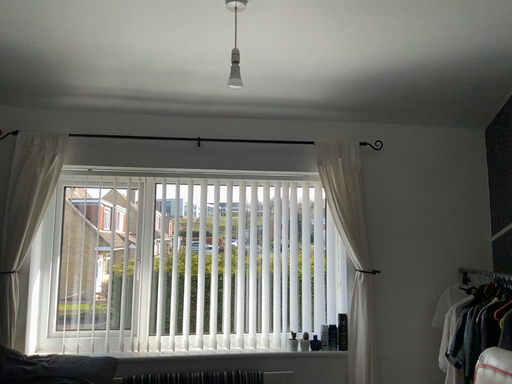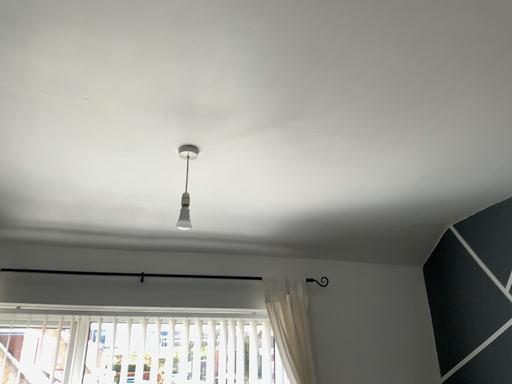
Question: How did the camera likely rotate when shooting the video?

Choices:
 (A) rotated upward
 (B) rotated downward

Answer: (A)